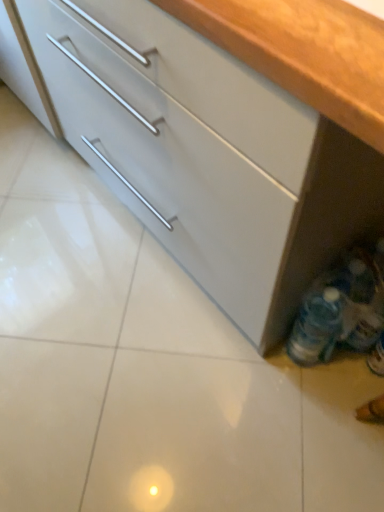
Image resolution: width=384 pixels, height=512 pixels. Identify the location of matte white cabinet at lower right. (200, 151).

Describe the element at coordinates (200, 151) in the screenshot. The image size is (384, 512). I see `matte white cabinet at lower right` at that location.

What do you see at coordinates (343, 311) in the screenshot?
I see `translucent plastic bottles at lower right` at bounding box center [343, 311].

This screenshot has width=384, height=512. Find the location of `translucent plastic bottles at lower right`. translucent plastic bottles at lower right is located at coordinates (343, 311).

Image resolution: width=384 pixels, height=512 pixels. In order to click on matte white cabinet at lower right in this screenshot , I will do `click(200, 151)`.

Does matte white cabinet at lower right appear on the right side of translucent plastic bottles at lower right?

No.

Which object is closer to the camera taking this photo, matte white cabinet at lower right or translucent plastic bottles at lower right?

matte white cabinet at lower right is closer to the camera.

Between point (164, 182) and point (378, 300), which one is positioned behind?

Point (164, 182)

From the image's perspective, is matte white cabinet at lower right beneath translucent plastic bottles at lower right?

Incorrect, from the image's perspective, matte white cabinet at lower right is higher than translucent plastic bottles at lower right.

From a real-world perspective, which is physically below, matte white cabinet at lower right or translucent plastic bottles at lower right?

translucent plastic bottles at lower right.

Is matte white cabinet at lower right wider than translucent plastic bottles at lower right?

Correct, the width of matte white cabinet at lower right exceeds that of translucent plastic bottles at lower right.

Between matte white cabinet at lower right and translucent plastic bottles at lower right, which one has less height?

Standing shorter between the two is translucent plastic bottles at lower right.

Considering the relative sizes of matte white cabinet at lower right and translucent plastic bottles at lower right in the image provided, is matte white cabinet at lower right smaller than translucent plastic bottles at lower right?

Incorrect, matte white cabinet at lower right is not smaller in size than translucent plastic bottles at lower right.

Is translucent plastic bottles at lower right surrounded by matte white cabinet at lower right?

That's correct, translucent plastic bottles at lower right is inside matte white cabinet at lower right.

In the scene shown: Are matte white cabinet at lower right and translucent plastic bottles at lower right far apart?

No, matte white cabinet at lower right is not far from translucent plastic bottles at lower right.

Is matte white cabinet at lower right oriented away from translucent plastic bottles at lower right?

Yes, matte white cabinet at lower right is facing away from translucent plastic bottles at lower right.

How different are the orientations of matte white cabinet at lower right and translucent plastic bottles at lower right in degrees?

They differ by 3.12 degrees in their facing directions.

Identify the location of cabinetry above the translucent plastic bottles at lower right (from a real-world perspective). This screenshot has height=512, width=384. (200, 151).

Between translucent plastic bottles at lower right and matte white cabinet at lower right, which one appears on the left side from the viewer's perspective?

matte white cabinet at lower right.

Between translucent plastic bottles at lower right and matte white cabinet at lower right, which one is positioned behind?

translucent plastic bottles at lower right.

Is point (361, 295) farther from camera compared to point (222, 168)?

Yes.

From the image's perspective, is translucent plastic bottles at lower right under matte white cabinet at lower right?

Yes.

From a real-world perspective, who is located higher, translucent plastic bottles at lower right or matte white cabinet at lower right?

matte white cabinet at lower right, from a real-world perspective.

Considering the relative sizes of translucent plastic bottles at lower right and matte white cabinet at lower right in the image provided, is translucent plastic bottles at lower right thinner than matte white cabinet at lower right?

Indeed, translucent plastic bottles at lower right has a lesser width compared to matte white cabinet at lower right.

Considering the sizes of objects translucent plastic bottles at lower right and matte white cabinet at lower right in the image provided, who is shorter, translucent plastic bottles at lower right or matte white cabinet at lower right?

Standing shorter between the two is translucent plastic bottles at lower right.

Who is bigger, translucent plastic bottles at lower right or matte white cabinet at lower right?

matte white cabinet at lower right.

Is translucent plastic bottles at lower right spatially inside matte white cabinet at lower right, or outside of it?

translucent plastic bottles at lower right fits inside matte white cabinet at lower right.

Can you see translucent plastic bottles at lower right touching matte white cabinet at lower right?

translucent plastic bottles at lower right and matte white cabinet at lower right are clearly separated.

Could you tell me if translucent plastic bottles at lower right is turned towards matte white cabinet at lower right?

Yes, translucent plastic bottles at lower right is turned towards matte white cabinet at lower right.

Looking at this image, can you tell me how much translucent plastic bottles at lower right and matte white cabinet at lower right differ in facing direction?

The facing directions of translucent plastic bottles at lower right and matte white cabinet at lower right are 3.12 degrees apart.

In the image, there is a matte white cabinet at lower right. Identify the location of bottle below it (from the image's perspective). This screenshot has height=512, width=384. (343, 311).

I want to click on bottle located underneath the matte white cabinet at lower right (from a real-world perspective), so click(x=343, y=311).

Image resolution: width=384 pixels, height=512 pixels. What are the coordinates of `bottle lying below the matte white cabinet at lower right (from the image's perspective)` in the screenshot? It's located at (343, 311).